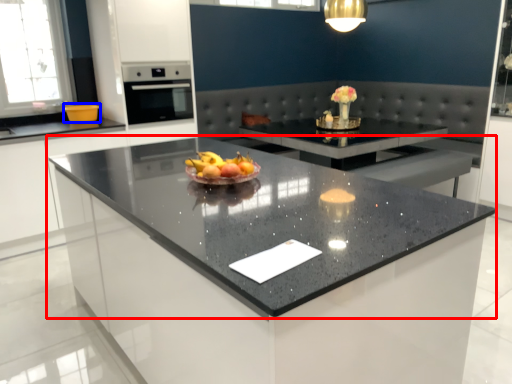
Question: Which point is further to the camera, countertop (highlighted by a red box) or kitchen appliance (highlighted by a blue box)?

Choices:
 (A) countertop
 (B) kitchen appliance

Answer: (B)